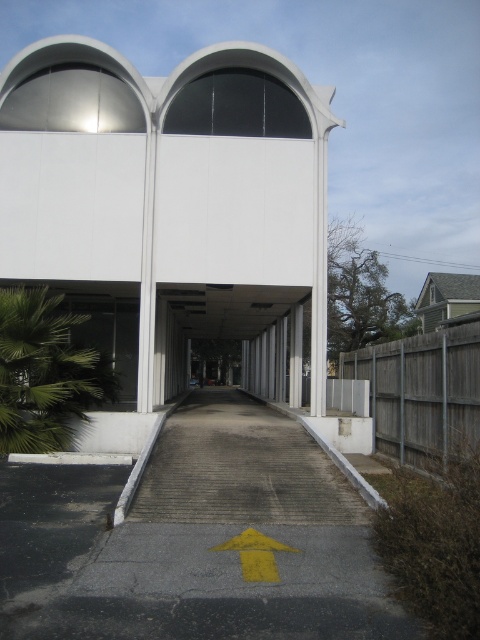
Question: Can you confirm if wooden fence at right is bigger than yellow matte arrow at center?

Choices:
 (A) no
 (B) yes

Answer: (B)

Question: Can you confirm if wooden fence at right is thinner than yellow matte arrow at center?

Choices:
 (A) no
 (B) yes

Answer: (B)

Question: Is wooden fence at right above yellow matte arrow at center?

Choices:
 (A) yes
 (B) no

Answer: (A)